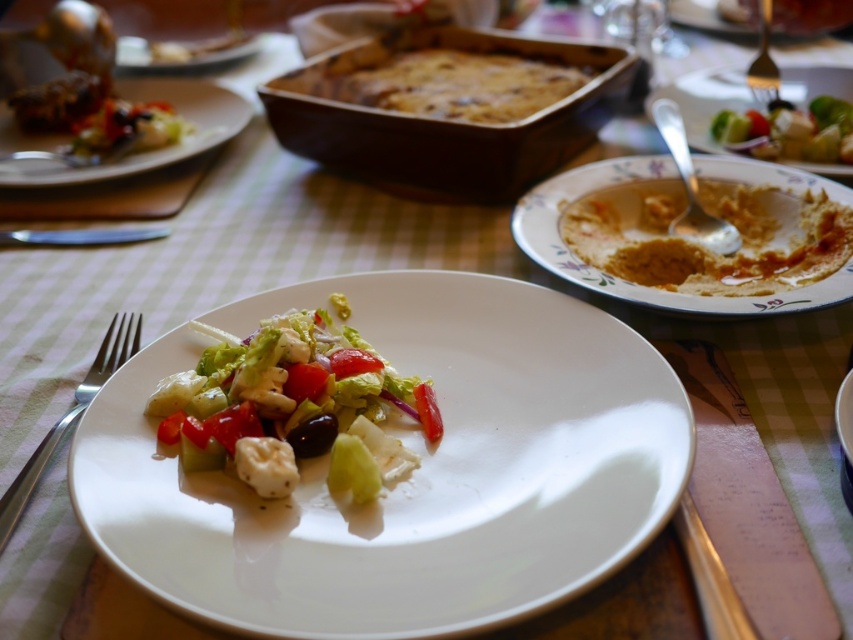
Consider the image. You are a server who needs to place a new menu between the silver metallic fork at left and the silver metallic spoon at upper right. The menu is 12 inches long. Will there be enough space between them to fit the menu horizontally?

The silver metallic fork at left and silver metallic spoon at upper right are 25.40 inches apart, so yes, the menu that is 12 inches long will fit horizontally between them since 25.40 inches is greater than 12 inches.

You are a server who needs to place a 12 inch long platter between the floral ceramic bowl at right and the matte white plate at upper left. Can you fit it there without moving either item?

The distance between the floral ceramic bowl at right and the matte white plate at upper left is 26.34 inches. Since the platter is only 12 inches long, there is enough space to place it between them without moving either item.

You are a guest at the table and want to reach both the floral ceramic bowl at right and the matte white plate at upper left. Which one will you need to stretch your arm further to reach?

You will need to stretch further to reach the matte white plate at upper left because it is farther from the viewer compared to the floral ceramic bowl at right, which is closer.